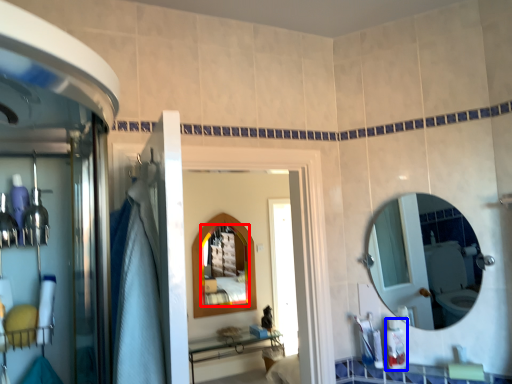
Question: Which object is further to the camera taking this photo, mirror (highlighted by a red box) or toiletry (highlighted by a blue box)?

Choices:
 (A) mirror
 (B) toiletry

Answer: (A)